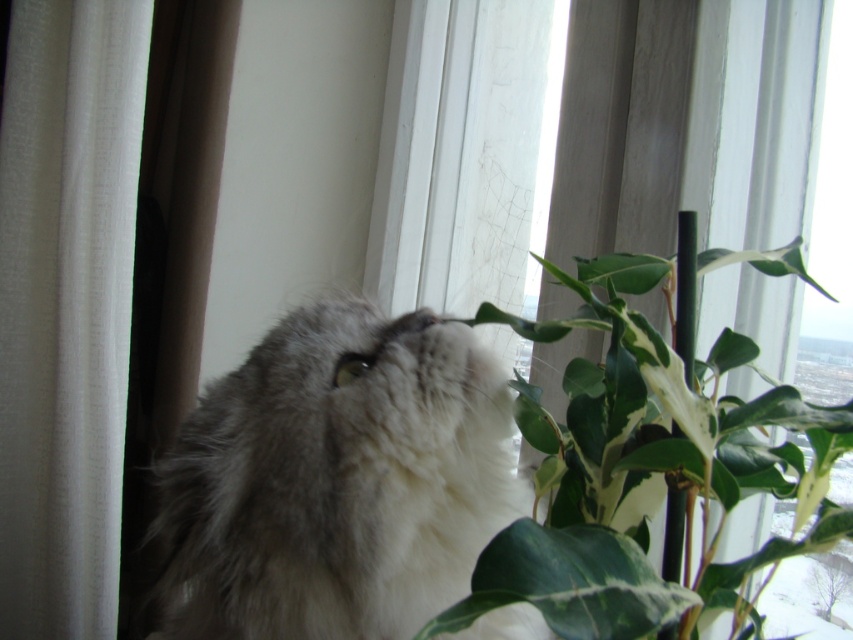
Question: Which point is farther from the camera taking this photo?

Choices:
 (A) (442, 474)
 (B) (418, 634)

Answer: (A)

Question: Where is fuzzy fur cat at center located in relation to green leafy plant at center in the image?

Choices:
 (A) below
 (B) above

Answer: (B)

Question: Is the position of fuzzy fur cat at center less distant than that of green leafy plant at center?

Choices:
 (A) yes
 (B) no

Answer: (B)

Question: Which point is closer to the camera?

Choices:
 (A) (590, 608)
 (B) (22, 292)

Answer: (A)

Question: Can you confirm if fuzzy fur cat at center is thinner than white sheer curtain at left?

Choices:
 (A) yes
 (B) no

Answer: (B)

Question: Which of these objects is positioned closest to the white sheer curtain at left?

Choices:
 (A) green leafy plant at center
 (B) fuzzy fur cat at center

Answer: (B)